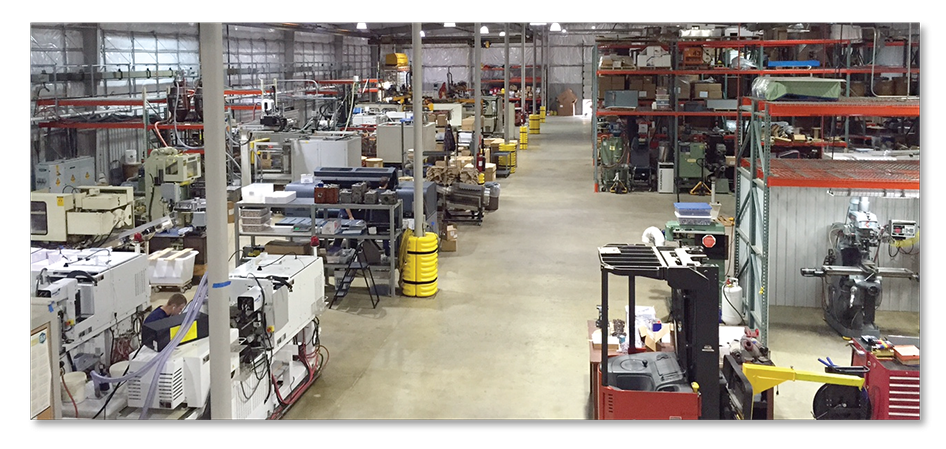
At what (x,y) coordinates should I click in order to perform the action: click on cords. Please return your answer as a coordinate pair (x, y). The image size is (946, 449). Looking at the image, I should click on (260, 303), (265, 331), (272, 387), (278, 395), (300, 389), (313, 359), (321, 323).